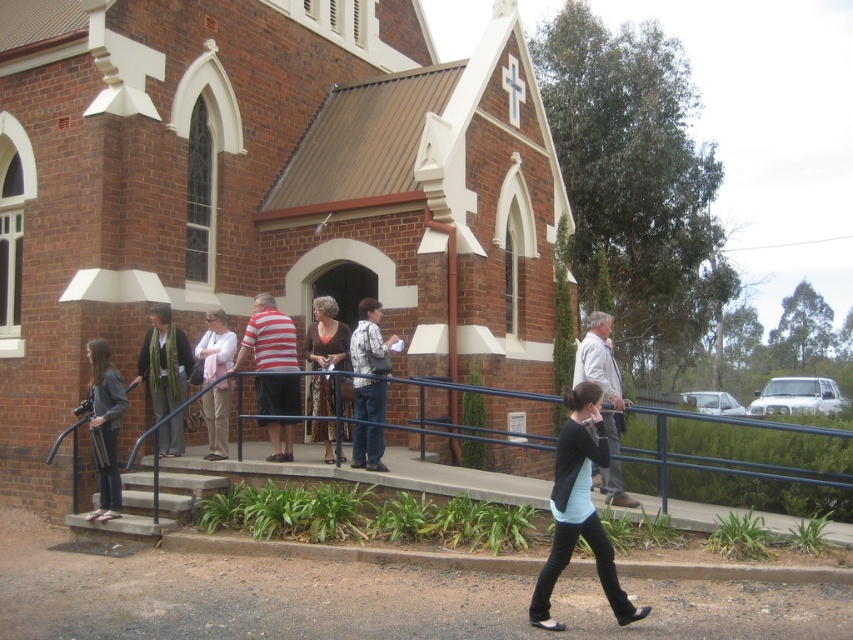
Who is positioned more to the left, brick church at center or denim jacket at lower left?

denim jacket at lower left is more to the left.

Who is more forward, [68,51] or [109,371]?

Point [109,371] is more forward.

This screenshot has width=853, height=640. I want to click on brick church at center, so click(260, 188).

What do you see at coordinates (387, 476) in the screenshot? The image size is (853, 640). I see `black metal railing at lower center` at bounding box center [387, 476].

Is black metal railing at lower center to the left of brown textured dress at center from the viewer's perspective?

Incorrect, black metal railing at lower center is not on the left side of brown textured dress at center.

Between point (166, 464) and point (317, 420), which one is positioned behind?

The point (166, 464) is behind.

At what (x,y) coordinates should I click in order to perform the action: click on black metal railing at lower center. Please return your answer as a coordinate pair (x, y). This screenshot has height=640, width=853. Looking at the image, I should click on (387, 476).

What are the coordinates of `denim jacket at lower left` in the screenshot? It's located at (105, 428).

Can you confirm if denim jacket at lower left is smaller than gray fabric jacket at center?

Correct, denim jacket at lower left occupies less space than gray fabric jacket at center.

Image resolution: width=853 pixels, height=640 pixels. Describe the element at coordinates (105, 428) in the screenshot. I see `denim jacket at lower left` at that location.

You are a GUI agent. You are given a task and a screenshot of the screen. Output one action in this format:
    pyautogui.click(x=<x>, y=<y>)
    Task: Click on the denim jacket at lower left
    The height and width of the screenshot is (640, 853).
    Given the screenshot: What is the action you would take?
    tap(105, 428)